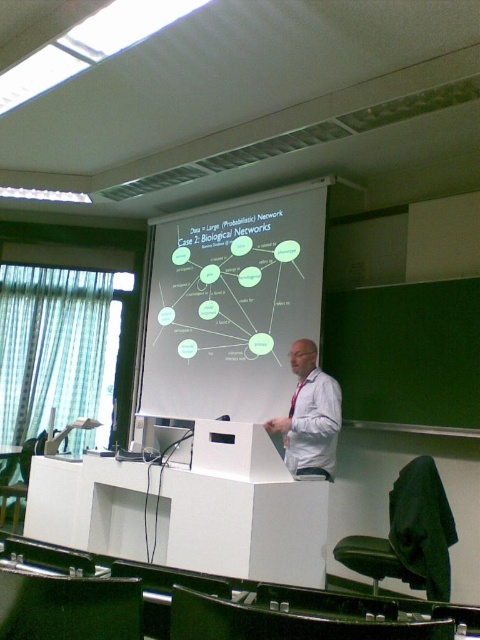
Does white matte projection screen at center have a larger size compared to white shirt at center?

Yes, white matte projection screen at center is bigger than white shirt at center.

Looking at this image, between white matte projection screen at center and white shirt at center, which one is positioned higher?

white matte projection screen at center is higher up.

Does point (189, 406) come closer to viewer compared to point (336, 449)?

That is False.

Locate an element on the screen. The image size is (480, 640). white matte projection screen at center is located at coordinates (230, 304).

How distant is white matte projection screen at center from white matte podium at center?

They are 1.56 meters apart.

Between white matte projection screen at center and white matte podium at center, which one appears on the left side from the viewer's perspective?

white matte podium at center is more to the left.

Who is more forward, (168, 264) or (323, 508)?

Positioned in front is point (323, 508).

In order to click on white matte projection screen at center in this screenshot , I will do `click(230, 304)`.

Between point (98, 506) and point (324, 440), which one is positioned in front?

Point (324, 440) is in front.

Consider the image. Between white matte podium at center and white shirt at center, which one has more height?

With more height is white matte podium at center.

What do you see at coordinates (190, 508) in the screenshot? This screenshot has height=640, width=480. I see `white matte podium at center` at bounding box center [190, 508].

Locate an element on the screen. white matte podium at center is located at coordinates (190, 508).